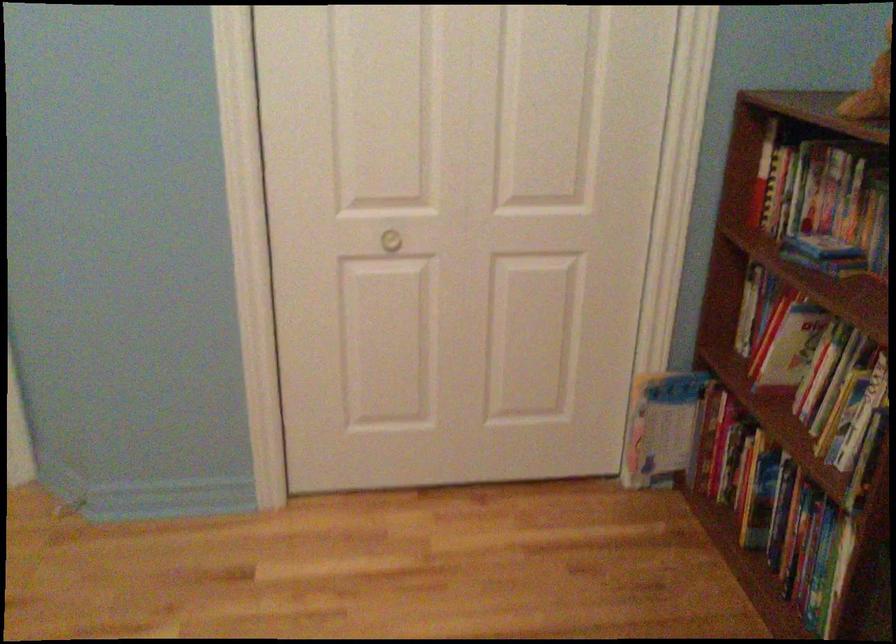
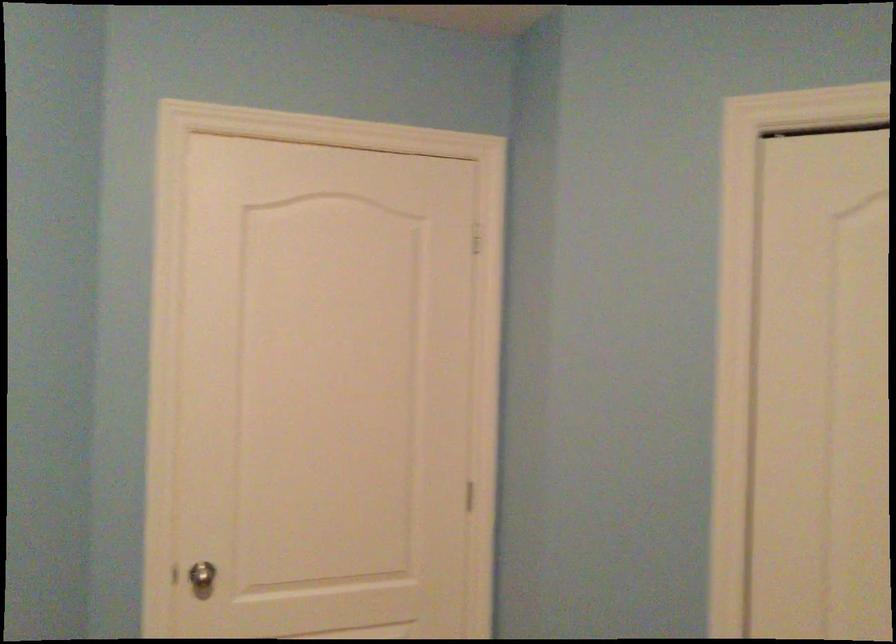
The images are taken continuously from a first-person perspective. In which direction is your viewpoint rotating?

The camera's rotation is toward left-up.